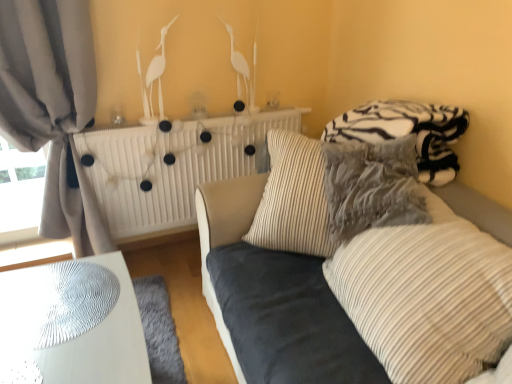
Question: Looking at their shapes, would you say striped fabric pillow at center, arranged as the second pillow when viewed from the front, is wider or thinner than striped fabric pillow at center, acting as the 1th pillow starting from the front?

Choices:
 (A) thin
 (B) wide

Answer: (B)

Question: Is striped fabric pillow at center, arranged as the second pillow when viewed from the front, situated inside striped fabric pillow at center, acting as the 1th pillow starting from the front, or outside?

Choices:
 (A) inside
 (B) outside

Answer: (B)

Question: Which is farther from the velvet blue couch at center?

Choices:
 (A) gray fabric curtain at left
 (B) white glossy table at lower left
 (C) zebra-patterned fleece blanket at upper right
 (D) white matte radiator at upper center
 (E) striped fabric pillow at center, acting as the 1th pillow starting from the front

Answer: (A)

Question: Based on their relative distances, which object is nearer to the velvet blue couch at center?

Choices:
 (A) zebra-patterned fleece blanket at upper right
 (B) gray fabric curtain at left
 (C) striped fabric pillow at center, which ranks as the 2th pillow in back-to-front order
 (D) white glossy table at lower left
 (E) white matte radiator at upper center

Answer: (C)